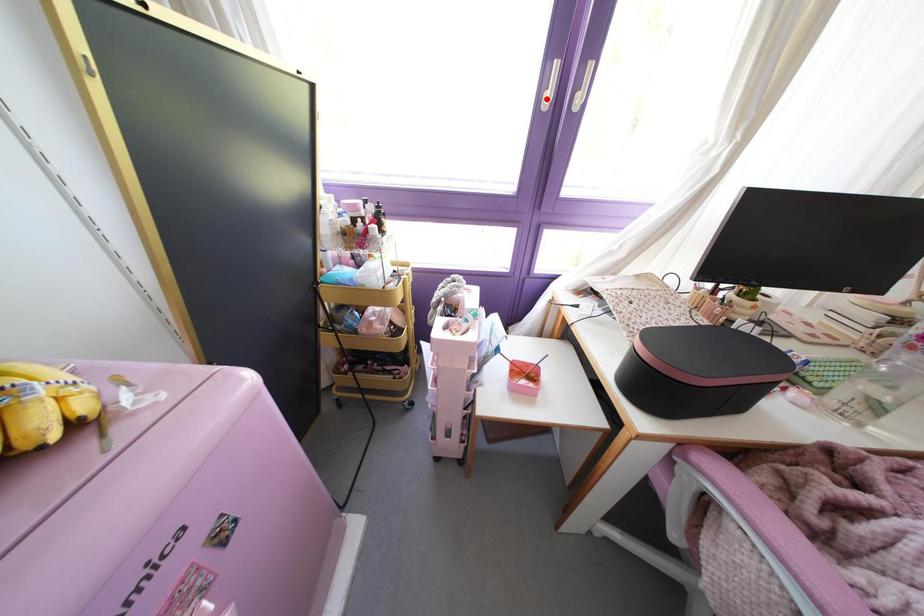
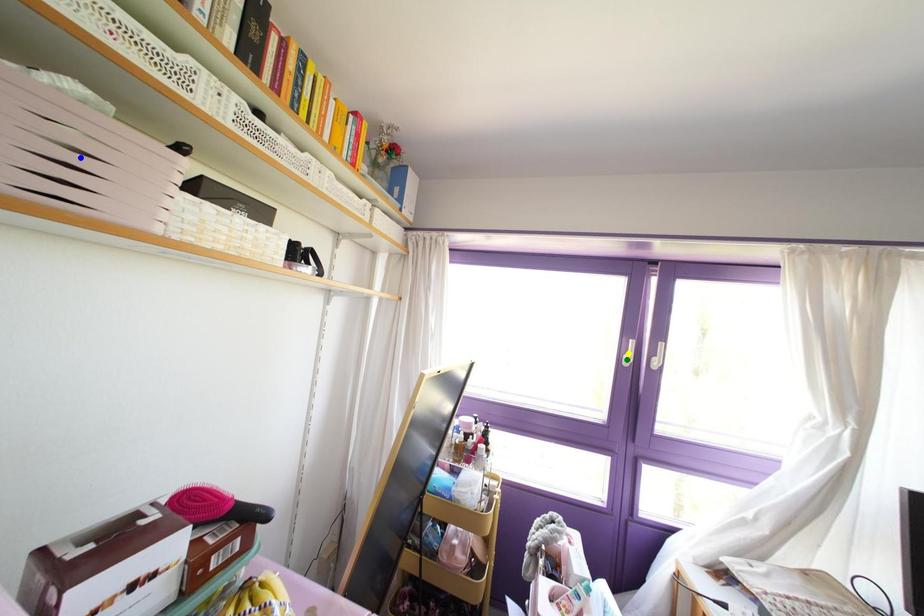
Question: I am providing you with two images of the same scene from different viewpoints. A red point is marked on the first image. You are given multiple points on the second image. In image 2, which mark is for the same physical point as the one in image 1?

Choices:
 (A) green point
 (B) yellow point
 (C) blue point

Answer: (A)